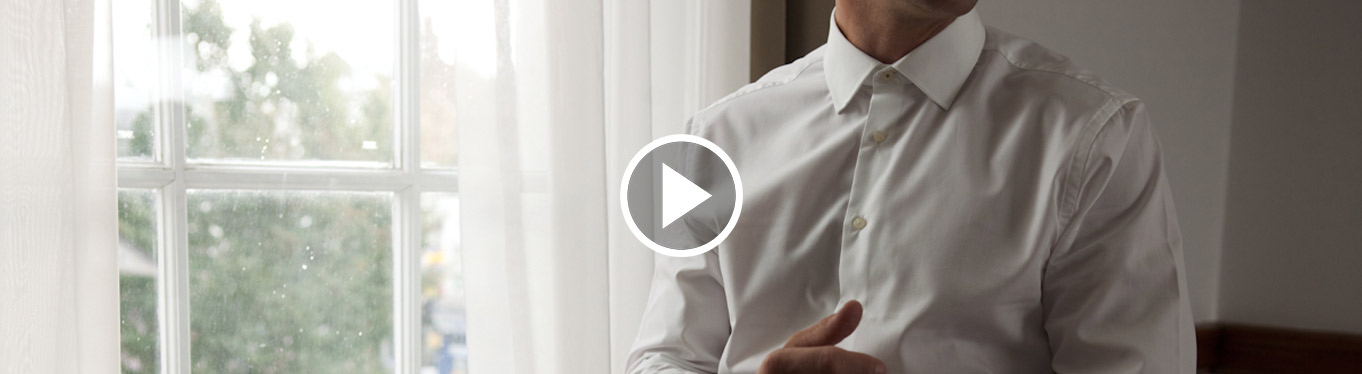
I want to click on window frame, so click(263, 187).